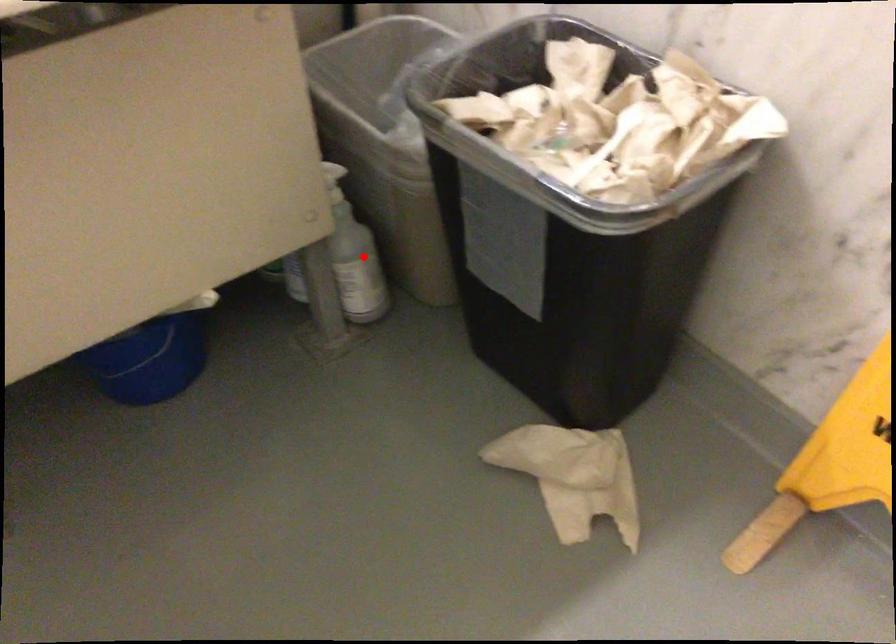
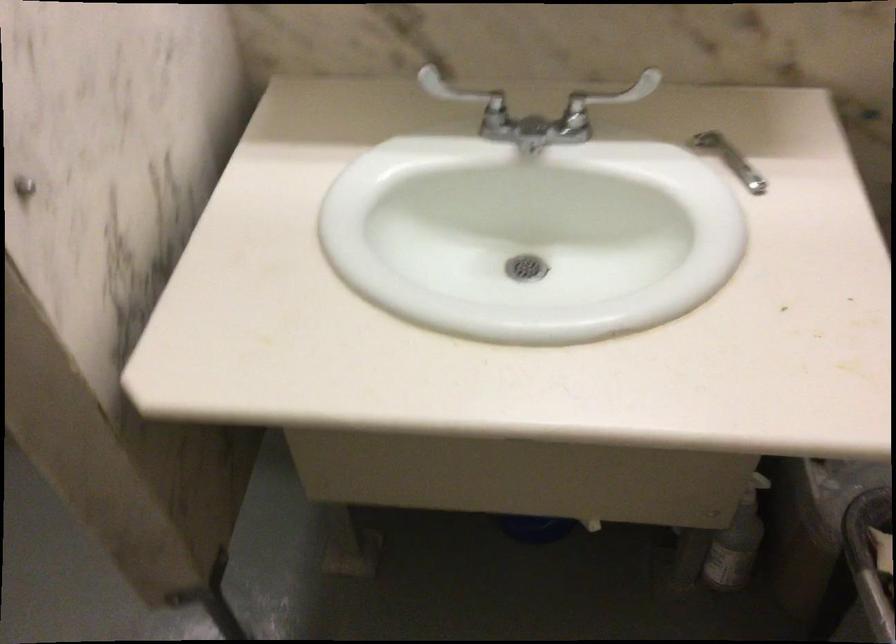
Find the pixel in the second image that matches the highlighted location in the first image.

(737, 542)